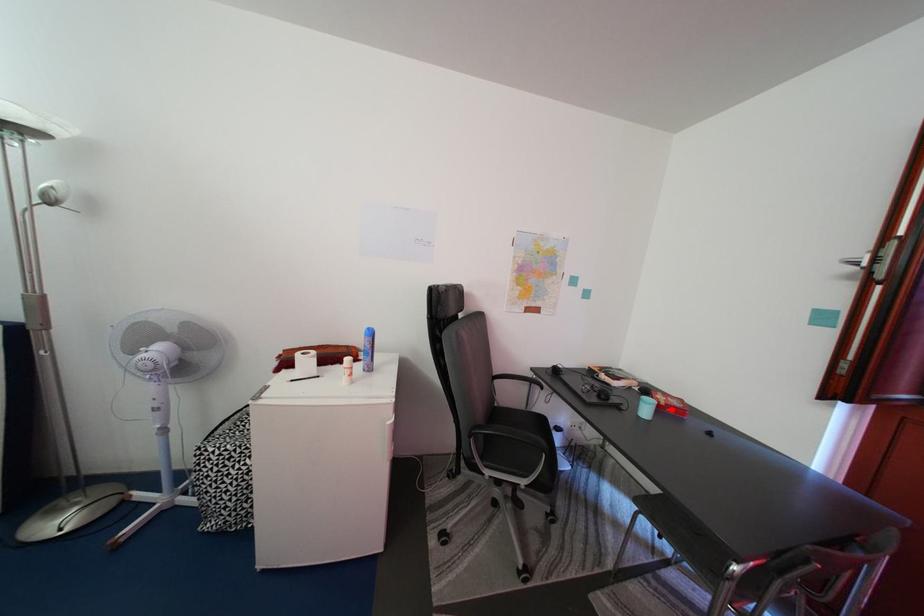
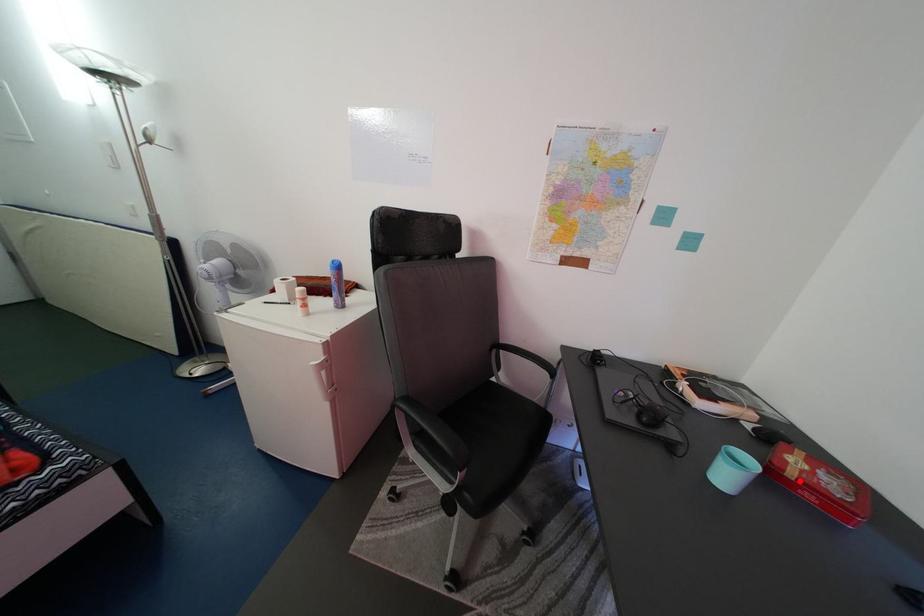
I am providing you with two images of the same scene from different viewpoints. A red point is marked on the first image and another point is marked on the second image. Is the marked point in image1 the same physical position as the marked point in image2?

Yes